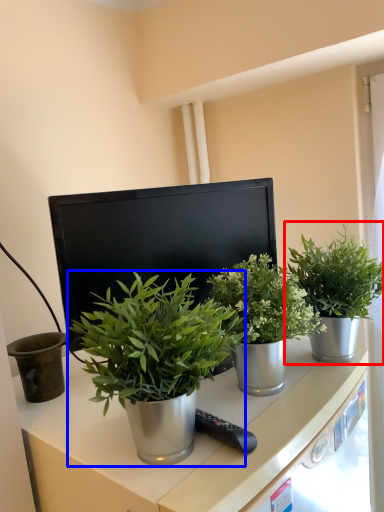
Question: Which object is closer to the camera taking this photo, houseplant (highlighted by a red box) or houseplant (highlighted by a blue box)?

Choices:
 (A) houseplant
 (B) houseplant

Answer: (B)